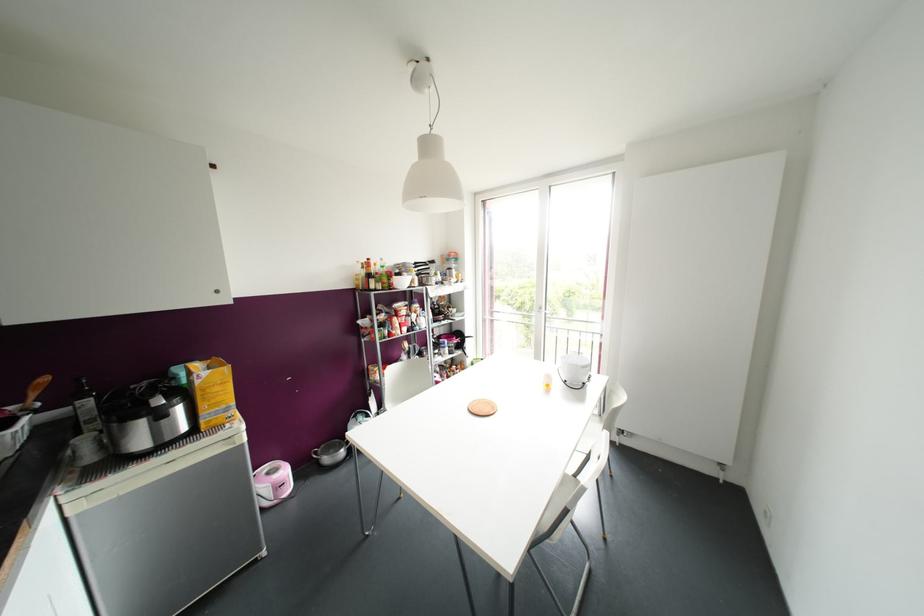
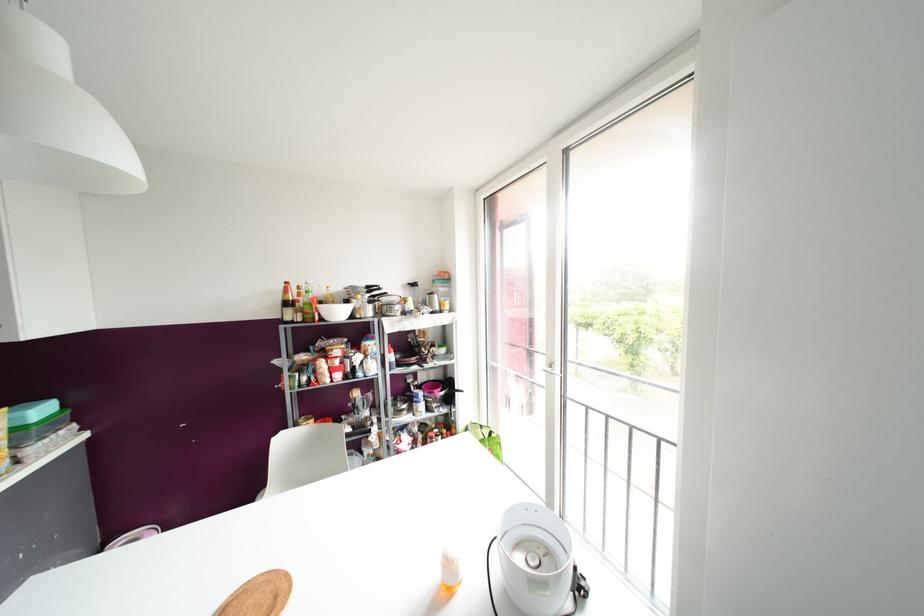
Which direction would the cameraman need to move to produce the second image?

The movement direction of the cameraman is right, forward.